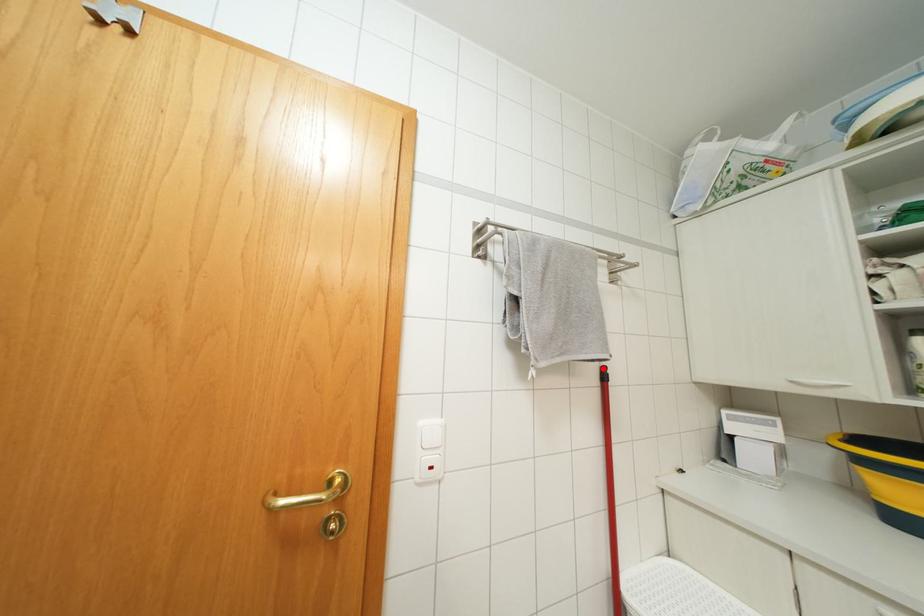
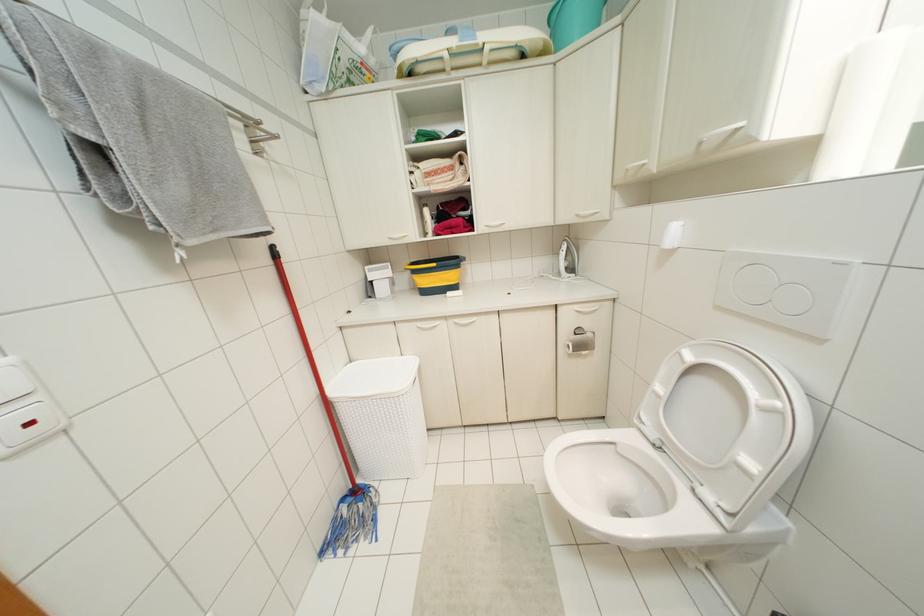
Find the pixel in the second image that matches the highlighted location in the first image.

(273, 246)